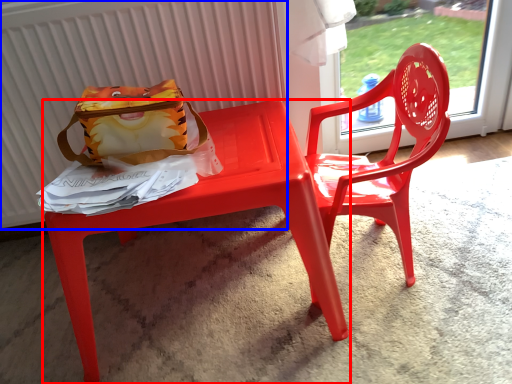
Question: Among these objects, which one is farthest to the camera, table (highlighted by a red box) or radiator (highlighted by a blue box)?

Choices:
 (A) table
 (B) radiator

Answer: (B)